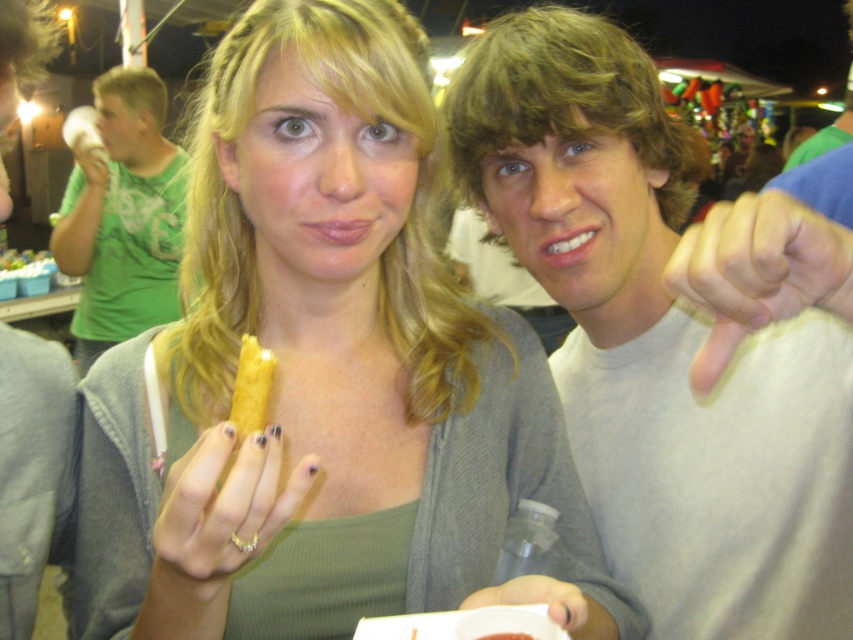
Question: Is smooth gray sweater at center smaller than yellow matte corn dog at center?

Choices:
 (A) yes
 (B) no

Answer: (B)

Question: Which point is closer to the camera?

Choices:
 (A) matte skin thumb at lower right
 (B) white matte plastic cup at lower center

Answer: (A)

Question: Can you confirm if smooth gray sweater at center is bigger than matte gray shirt at center?

Choices:
 (A) no
 (B) yes

Answer: (A)

Question: Can you confirm if matte skin thumb at lower right is positioned to the right of yellow matte corn dog at center?

Choices:
 (A) no
 (B) yes

Answer: (B)

Question: Among these objects, which one is nearest to the camera?

Choices:
 (A) matte yellow snack at center
 (B) white matte plastic cup at lower center
 (C) smooth gray sweater at center
 (D) matte skin thumb at lower right

Answer: (D)

Question: Which point appears farthest from the camera in this image?

Choices:
 (A) (495, 243)
 (B) (467, 596)
 (C) (231, 340)
 (D) (511, 632)

Answer: (A)